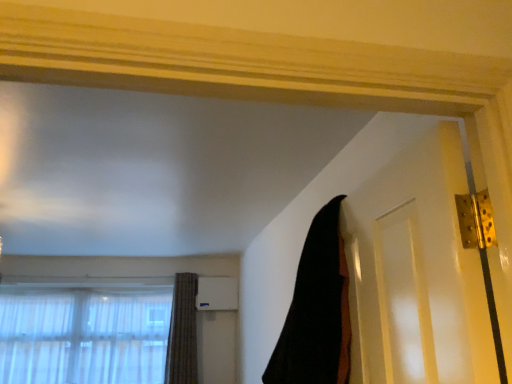
Question: Looking at the image, does black fabric at upper right, positioned as the first curtain in right-to-left order, seem bigger or smaller compared to textured brown curtain at lower left, which ranks as the second curtain in top-to-bottom order?

Choices:
 (A) big
 (B) small

Answer: (A)

Question: Based on their positions, is black fabric at upper right, the 1th curtain from the front, located to the left or right of textured brown curtain at lower left, the 2th curtain viewed from the right?

Choices:
 (A) right
 (B) left

Answer: (A)

Question: Which is nearer to the black fabric at upper right, positioned as the first curtain in top-to-bottom order?

Choices:
 (A) textured brown curtain at lower left, which ranks as the second curtain in top-to-bottom order
 (B) translucent fabric at lower left

Answer: (A)

Question: Estimate the real-world distances between objects in this image. Which object is farther from the translucent fabric at lower left?

Choices:
 (A) textured brown curtain at lower left, which appears as the first curtain when viewed from the back
 (B) black fabric at upper right, marked as the 2th curtain in a bottom-to-top arrangement

Answer: (B)